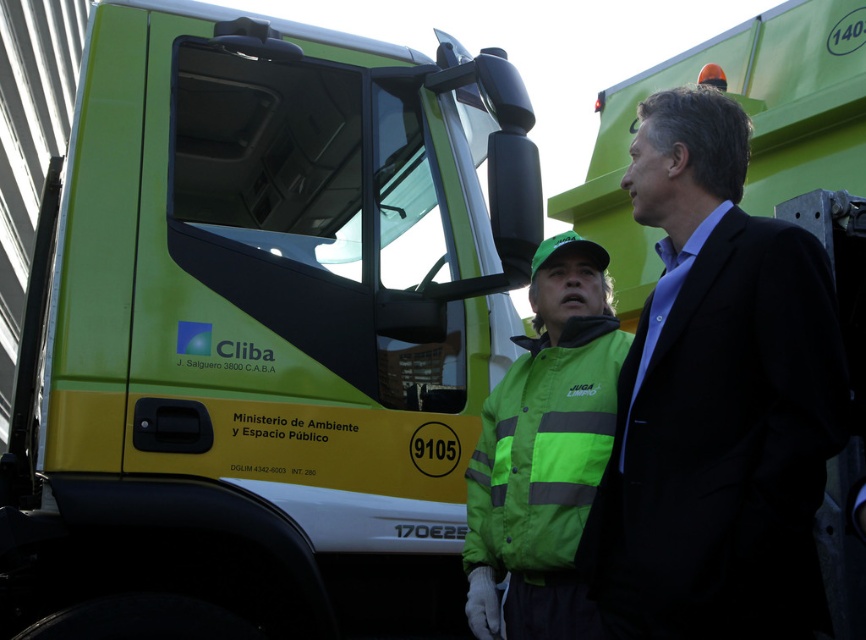
Which is below, green matte truck at center or black matte suit at center?

black matte suit at center is below.

Who is more distant from viewer, [421,445] or [725,106]?

The point [421,445] is more distant.

Where is `green matte truck at center`? green matte truck at center is located at coordinates coord(259,326).

I want to click on green matte truck at center, so click(259, 326).

Which is more to the left, green matte truck at center or green reflective safety vest at center?

green matte truck at center

Who is higher up, green matte truck at center or green reflective safety vest at center?

green matte truck at center is above.

What do you see at coordinates (259, 326) in the screenshot? I see `green matte truck at center` at bounding box center [259, 326].

Identify the location of green matte truck at center. The width and height of the screenshot is (866, 640). (259, 326).

In the scene shown: Can you confirm if black matte suit at center is smaller than green reflective safety vest at center?

No, black matte suit at center is not smaller than green reflective safety vest at center.

Is black matte suit at center positioned behind green reflective safety vest at center?

No, it is not.

What are the coordinates of `black matte suit at center` in the screenshot? It's located at (716, 401).